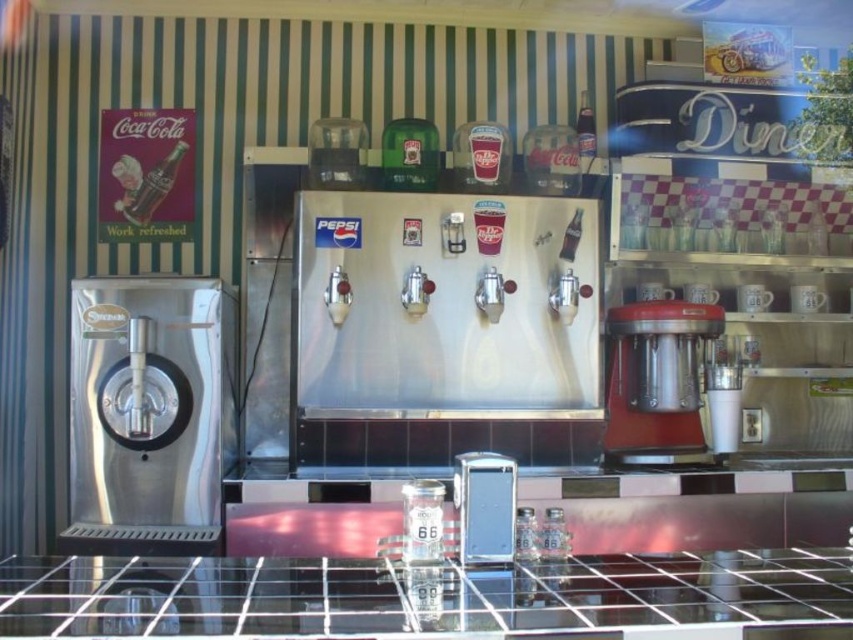
Measure the distance from metallic red coffee machine at center-right to metallic silver dispenser at center.

metallic red coffee machine at center-right and metallic silver dispenser at center are 4.16 feet apart from each other.

Identify the location of metallic red coffee machine at center-right. The image size is (853, 640). (656, 380).

This screenshot has width=853, height=640. What do you see at coordinates (656, 380) in the screenshot? I see `metallic red coffee machine at center-right` at bounding box center [656, 380].

You are a GUI agent. You are given a task and a screenshot of the screen. Output one action in this format:
    pyautogui.click(x=<x>, y=<y>)
    Task: Click on the metallic red coffee machine at center-right
    
    Given the screenshot: What is the action you would take?
    (656, 380)

Is point (154, 529) farther from viewer compared to point (509, 545)?

Yes, it is behind point (509, 545).

Which is more to the right, brushed metal espresso machine at left or metallic silver dispenser at center?

metallic silver dispenser at center is more to the right.

Where is `brushed metal espresso machine at left`? This screenshot has width=853, height=640. brushed metal espresso machine at left is located at coordinates (149, 410).

This screenshot has height=640, width=853. Identify the location of brushed metal espresso machine at left. (149, 410).

Which is above, brushed metal espresso machine at left or metallic red coffee machine at center-right?

metallic red coffee machine at center-right is higher up.

Between brushed metal espresso machine at left and metallic red coffee machine at center-right, which one appears on the left side from the viewer's perspective?

brushed metal espresso machine at left is more to the left.

Is point (78, 364) farther from viewer compared to point (669, 364)?

That is False.

This screenshot has height=640, width=853. Identify the location of brushed metal espresso machine at left. (149, 410).